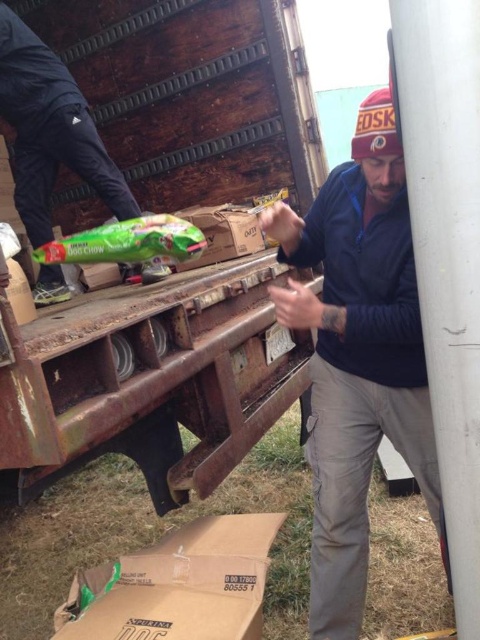
You are helping unload items from the truck bed. You need to place both the metallic gray pole at right and the brown cardboard box at center into a storage area. The storage area has a width of 1 meter. Can both items fit side by side without overlapping?

The metallic gray pole at right occupies less space than the brown cardboard box at center. However, without knowing the exact dimensions of each item, it is impossible to determine if their combined width would exceed the 1 meter storage area. More information is needed.

You are a delivery person who needs to place the brown cardboard box at lower center near the metallic gray pole at right. The space between them must be exactly 30 inches. Is the current distance sufficient?

The metallic gray pole at right and brown cardboard box at lower center are 28.57 inches apart from each other. Since 28.57 inches is less than 30 inches, the current distance is not sufficient. You need to move the brown cardboard box at lower center further away from the metallic gray pole at right to meet the required spacing.

You are a delivery person standing next to the truck bed. You need to place the brown cardboard box at lower center onto a shelf that is 1.2 meters tall. Can you use the metallic gray pole at right to reach the shelf?

The metallic gray pole at right is closer to the viewer than brown cardboard box at lower center. Since the pole is closer, it might be positioned in a way that allows you to use it to reach the 1.2 meter tall shelf. However, without knowing the pole height, it is uncertain. But according to the description, the pole is metallic and possibly sturdy. Assuming it is a support pole, it might be tall enough. However, the answer should strictly use the given description. Since the description only mentions the 1